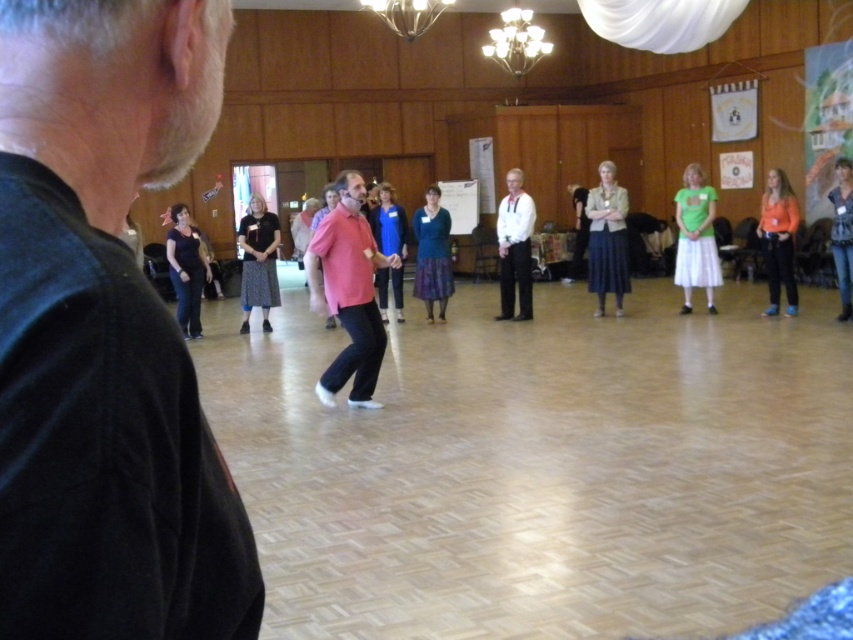
Question: Which object appears closest to the camera in this image?

Choices:
 (A) white smooth shirt at center
 (B) matte black shirt at left

Answer: (B)

Question: Does orange fleece jacket at right appear under matte black dress at right?

Choices:
 (A) yes
 (B) no

Answer: (B)

Question: Which object is the farthest from the blue fabric skirt at center?

Choices:
 (A) green jersey at center
 (B) matte black shirt at left
 (C) matte black skirt at center

Answer: (B)

Question: From the image, what is the correct spatial relationship of light beige fabric skirt at center in relation to orange fleece jacket at right?

Choices:
 (A) above
 (B) below

Answer: (A)

Question: Which object is positioned farthest from the green jersey at center?

Choices:
 (A) matte black dress at right
 (B) matte black skirt at center
 (C) pink matte shirt at center

Answer: (C)

Question: Does blue textured skirt at center have a larger size compared to white glass chandelier at upper center?

Choices:
 (A) no
 (B) yes

Answer: (A)